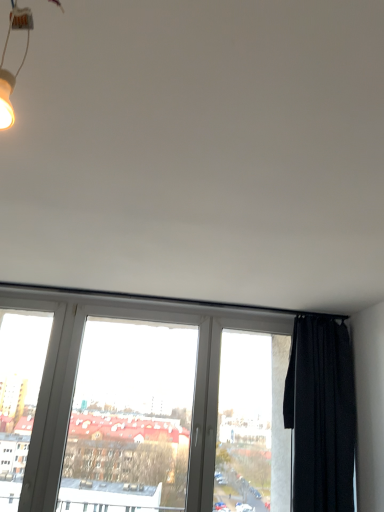
Question: From the image's perspective, is white plastic window frame at left above white plastic window at center?

Choices:
 (A) yes
 (B) no

Answer: (A)

Question: Can you confirm if white plastic window frame at left is bigger than white plastic window at center?

Choices:
 (A) no
 (B) yes

Answer: (A)

Question: Is white plastic window frame at left positioned with its back to white plastic window at center?

Choices:
 (A) no
 (B) yes

Answer: (A)

Question: Can you confirm if white plastic window frame at left is wider than white plastic window at center?

Choices:
 (A) no
 (B) yes

Answer: (A)

Question: From the image's perspective, would you say white plastic window frame at left is shown under white plastic window at center?

Choices:
 (A) yes
 (B) no

Answer: (B)

Question: Choose the correct answer: Is white plastic window at center inside white plastic window frame at left or outside it?

Choices:
 (A) inside
 (B) outside

Answer: (B)

Question: Does point (187, 331) appear closer or farther from the camera than point (23, 465)?

Choices:
 (A) farther
 (B) closer

Answer: (A)

Question: From the image's perspective, is white plastic window at center located above or below white plastic window frame at left?

Choices:
 (A) above
 (B) below

Answer: (B)

Question: Considering the positions of white plastic window at center and white plastic window frame at left in the image, is white plastic window at center bigger or smaller than white plastic window frame at left?

Choices:
 (A) small
 (B) big

Answer: (B)

Question: From the image's perspective, relative to black matte curtain at right, is white plastic window frame at left above or below?

Choices:
 (A) above
 (B) below

Answer: (A)

Question: Is white plastic window frame at left wider or thinner than black matte curtain at right?

Choices:
 (A) wide
 (B) thin

Answer: (B)

Question: Considering the positions of white plastic window frame at left and black matte curtain at right in the image, is white plastic window frame at left taller or shorter than black matte curtain at right?

Choices:
 (A) tall
 (B) short

Answer: (A)

Question: Is white plastic window frame at left to the left or to the right of black matte curtain at right in the image?

Choices:
 (A) right
 (B) left

Answer: (B)

Question: In the image, is white plastic window at center positioned in front of or behind black matte curtain at right?

Choices:
 (A) behind
 (B) front

Answer: (A)

Question: Is white plastic window at center wider or thinner than black matte curtain at right?

Choices:
 (A) wide
 (B) thin

Answer: (B)